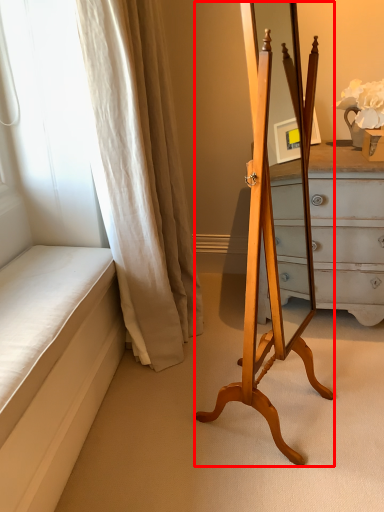
Question: From the image's perspective, what is the correct spatial positioning of easel (annotated by the red box) in reference to curtain?

Choices:
 (A) above
 (B) below

Answer: (B)